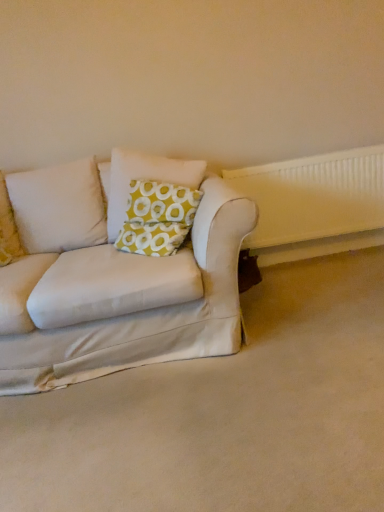
Question: Which is correct: yellow-green fabric pillow at center is inside white plastic radiator at right, or outside of it?

Choices:
 (A) inside
 (B) outside

Answer: (B)

Question: From a real-world perspective, relative to white plastic radiator at right, is yellow-green fabric pillow at center vertically above or below?

Choices:
 (A) below
 (B) above

Answer: (B)

Question: Which object is positioned farthest from the white fabric couch at lower left?

Choices:
 (A) yellow-green fabric pillow at center
 (B) white plastic radiator at right

Answer: (B)

Question: Which object is the closest to the white fabric couch at lower left?

Choices:
 (A) white plastic radiator at right
 (B) yellow-green fabric pillow at center

Answer: (B)